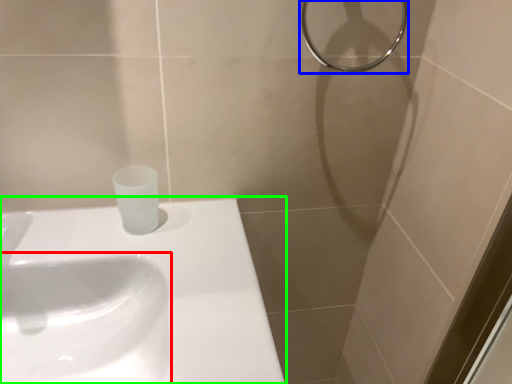
Question: Based on their relative distances, which object is farther from sink (highlighted by a red box)? Choose from shower (highlighted by a blue box) and sink (highlighted by a green box).

Choices:
 (A) shower
 (B) sink

Answer: (A)